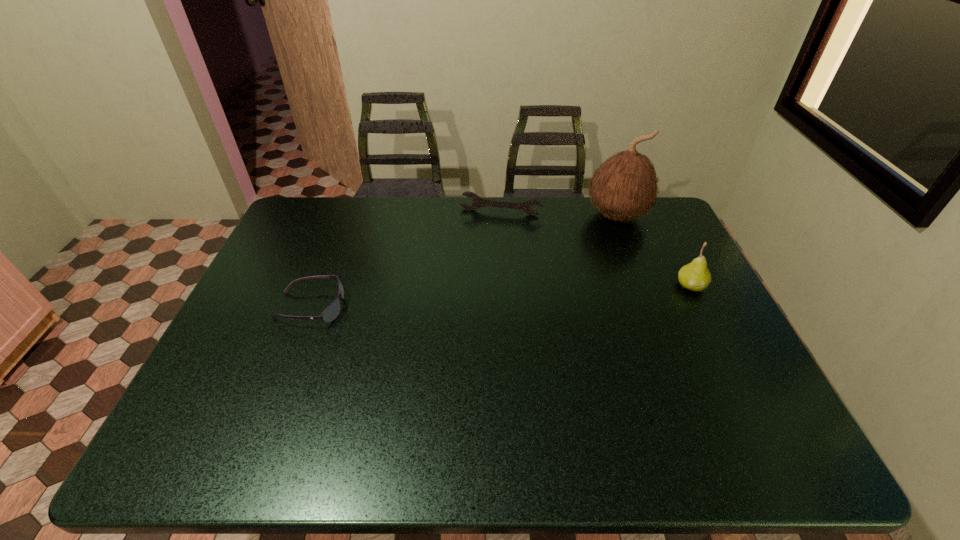
Where is `free space located 0.230m on the open ends of the second object from left to right`? free space located 0.230m on the open ends of the second object from left to right is located at coordinates (484, 259).

The image size is (960, 540). Identify the location of vacant space located on the surface of the tallest object. (573, 276).

Where is `vacant space situated 0.180m on the surface of the tallest object`? The height and width of the screenshot is (540, 960). vacant space situated 0.180m on the surface of the tallest object is located at coordinates (584, 262).

The width and height of the screenshot is (960, 540). Find the location of `free spot located 0.360m on the surface of the tallest object`. free spot located 0.360m on the surface of the tallest object is located at coordinates (559, 296).

Locate an element on the screen. wrench present at the far edge is located at coordinates (478, 202).

Locate an element on the screen. coconut that is at the far edge is located at coordinates (625, 186).

Locate an element on the screen. Image resolution: width=960 pixels, height=540 pixels. object that is at the left edge is located at coordinates (332, 311).

Where is `pear located at the right edge`? This screenshot has width=960, height=540. pear located at the right edge is located at coordinates (695, 276).

Find the location of a particular element. coconut present at the right edge is located at coordinates (625, 186).

The height and width of the screenshot is (540, 960). I want to click on object present at the far right corner, so click(x=625, y=186).